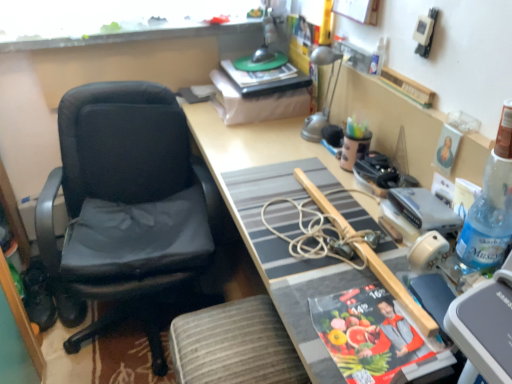
At what (x,y) coordinates should I click in order to perform the action: click on free location above gray fabric stool at lower center (from a real-world perspective). Please return your answer as a coordinate pair (x, y). The image size is (512, 384). Looking at the image, I should click on (232, 341).